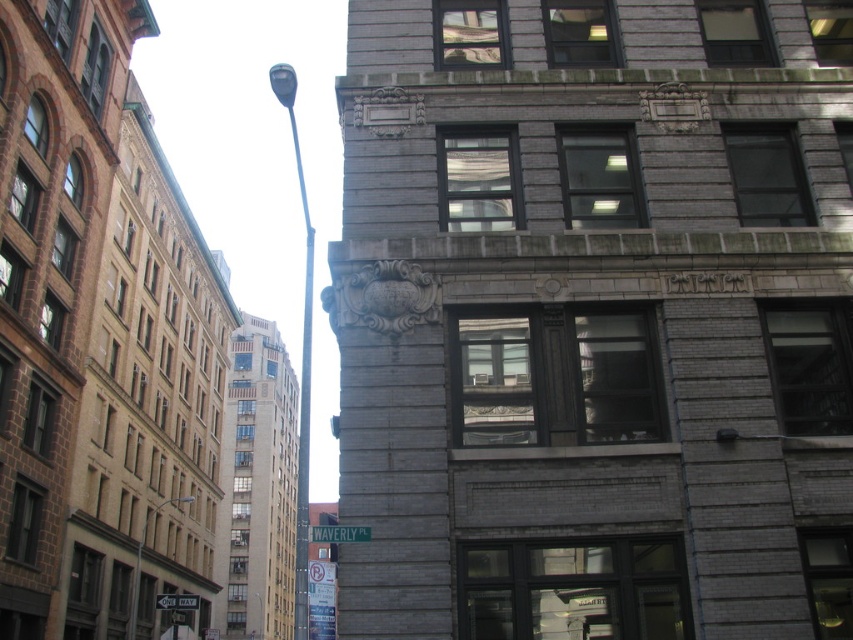
Question: Is polished metal streetlight at center smaller than green metallic street sign at upper center?

Choices:
 (A) yes
 (B) no

Answer: (B)

Question: Which object is the farthest from the polished metal streetlight at center?

Choices:
 (A) metallic pole at center
 (B) green metallic street sign at upper center

Answer: (B)

Question: Which object is positioned farthest from the polished metal streetlight at center?

Choices:
 (A) green plastic street sign at lower center
 (B) metallic pole at center

Answer: (A)

Question: Estimate the real-world distances between objects in this image. Which object is farther from the green metallic street sign at upper center?

Choices:
 (A) polished metal streetlight at center
 (B) metallic pole at center

Answer: (A)

Question: From the image, what is the correct spatial relationship of metallic pole at center in relation to green metallic street sign at upper center?

Choices:
 (A) right
 (B) left

Answer: (B)

Question: Does polished metal streetlight at center appear on the right side of green plastic street sign at lower center?

Choices:
 (A) yes
 (B) no

Answer: (B)